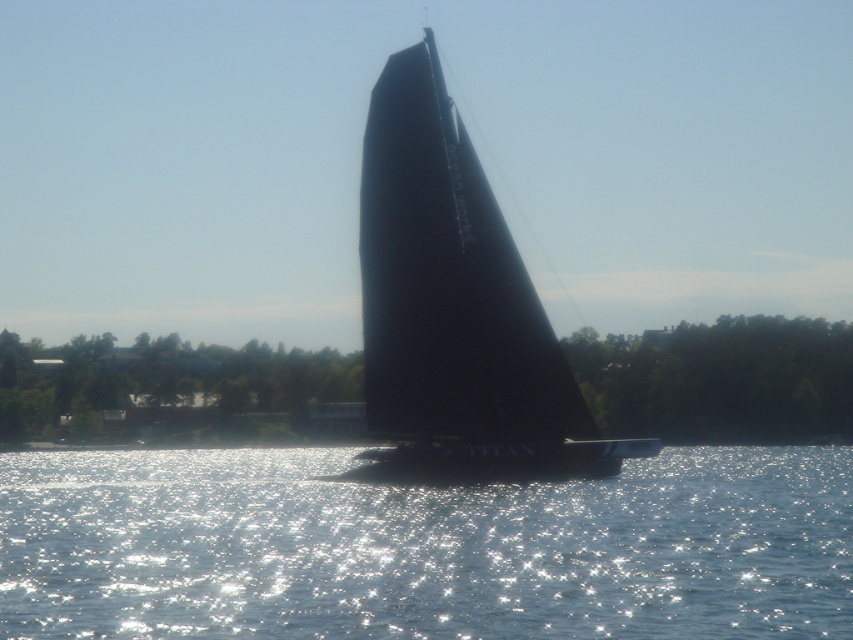
Can you confirm if sparkling water at center is positioned to the right of black matte sailboat at center?

Incorrect, sparkling water at center is not on the right side of black matte sailboat at center.

Between point (781, 636) and point (380, 380), which one is positioned in front?

Point (781, 636) is more forward.

Between point (740, 580) and point (485, 342), which one is positioned in front?

Point (740, 580) is in front.

This screenshot has height=640, width=853. I want to click on sparkling water at center, so click(422, 547).